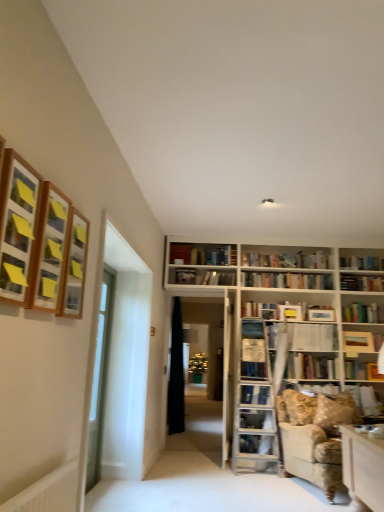
This screenshot has height=512, width=384. Find the location of `black fabric curtain at center`. black fabric curtain at center is located at coordinates (176, 374).

Describe the element at coordinates (313, 337) in the screenshot. This screenshot has height=512, width=384. I see `hardcover book at upper center, the 4th book ordered from the bottom` at that location.

Where is `wooden frame at upper left, arranged as the 3th shelf when viewed from the front`? The width and height of the screenshot is (384, 512). wooden frame at upper left, arranged as the 3th shelf when viewed from the front is located at coordinates (74, 267).

This screenshot has height=512, width=384. I want to click on clear glass door at center, which is the 1th glass door from left to right, so click(99, 380).

At what (x,y) coordinates should I click in order to perform the action: click on wooden bookshelf at upper center, marked as the 3th book in a bottom-to-top arrangement. Please return your answer as a coordinate pair (x, y). Looking at the image, I should click on click(x=358, y=342).

Find the location of a particular element. This screenshot has height=512, width=384. black fabric curtain at center is located at coordinates (176, 374).

From the image's perspective, between hardcover book at lower right, the 3th book positioned from the back, and black fabric curtain at center, who is located below?

black fabric curtain at center appears lower in the image.

Is hardcover book at lower right, which appears as the 1th book when ordered from the bottom, at the right side of black fabric curtain at center?

Yes.

Can you tell me how much hardcover book at lower right, the 3th book positioned from the back, and black fabric curtain at center differ in facing direction?

The angle between the facing direction of hardcover book at lower right, the 3th book positioned from the back, and the facing direction of black fabric curtain at center is 90.3 degrees.

From the image's perspective, between black fabric curtain at center and hardcover book at upper center, arranged as the 3th book when viewed from the front, who is located below?

black fabric curtain at center appears lower in the image.

Which of these two, black fabric curtain at center or hardcover book at upper center, the 4th book ordered from the bottom, stands taller?

black fabric curtain at center is taller.

Looking at this image, based on their sizes in the image, would you say black fabric curtain at center is bigger or smaller than hardcover book at upper center, the 4th book ordered from the bottom?

black fabric curtain at center is bigger than hardcover book at upper center, the 4th book ordered from the bottom.

Visually, is hardcover book at upper center, acting as the 2th book starting from the back, positioned to the left or to the right of wooden bookshelf at center?

In the image, hardcover book at upper center, acting as the 2th book starting from the back, appears on the right side of wooden bookshelf at center.

Is the position of hardcover book at upper center, acting as the 2th book starting from the back, more distant than that of wooden bookshelf at center?

No, it is not.

Is hardcover book at upper center, arranged as the 3th book when viewed from the front, shorter than wooden bookshelf at center?

Yes, hardcover book at upper center, arranged as the 3th book when viewed from the front, is shorter than wooden bookshelf at center.

From a real-world perspective, is hardcover book at upper center, arranged as the 3th book when viewed from the front, above or below wooden bookshelf at center?

From a real-world perspective, hardcover book at upper center, arranged as the 3th book when viewed from the front, is physically above wooden bookshelf at center.

In the scene shown: Can you tell me how much wooden bookshelf at upper center, the 4th book from the front, and hardcover book at lower right, marked as the 4th book in a top-to-bottom arrangement, differ in facing direction?

There is a 2.89-degree angle between the facing directions of wooden bookshelf at upper center, the 4th book from the front, and hardcover book at lower right, marked as the 4th book in a top-to-bottom arrangement.

Does point (370, 349) come in front of point (353, 395)?

No, it is behind (353, 395).

Is wooden bookshelf at upper center, the 4th book from the front, closer to camera compared to hardcover book at lower right, the 2th book from the front?

No, the depth of wooden bookshelf at upper center, the 4th book from the front, is greater than that of hardcover book at lower right, the 2th book from the front.

In the scene shown: Is wooden bookshelf at upper center, the first book positioned from the back, spatially inside hardcover book at lower right, marked as the 4th book in a top-to-bottom arrangement, or outside of it?

wooden bookshelf at upper center, the first book positioned from the back, exists outside the volume of hardcover book at lower right, marked as the 4th book in a top-to-bottom arrangement.

Is wooden bookshelf at upper center, the first book positioned from the back, a part of black fabric curtain at center?

No, wooden bookshelf at upper center, the first book positioned from the back, is not a part of black fabric curtain at center.

Between black fabric curtain at center and wooden bookshelf at upper center, the second book in the top-to-bottom sequence, which one has larger size?

black fabric curtain at center.

Is wooden bookshelf at upper center, the 4th book from the front, at the back of black fabric curtain at center?

black fabric curtain at center is not turned away from wooden bookshelf at upper center, the 4th book from the front.

Would you consider hardcover book at lower right, marked as the 4th book in a top-to-bottom arrangement, to be distant from floral fabric couch at lower right?

No.

From the image's perspective, which one is positioned higher, hardcover book at lower right, which appears as the 1th book when ordered from the bottom, or floral fabric couch at lower right?

hardcover book at lower right, which appears as the 1th book when ordered from the bottom, is shown above in the image.

Is hardcover book at lower right, the 3th book positioned from the back, aimed at floral fabric couch at lower right?

No, hardcover book at lower right, the 3th book positioned from the back, is not turned towards floral fabric couch at lower right.

Considering the sizes of objects hardcover book at lower right, which appears as the 1th book when ordered from the bottom, and floral fabric couch at lower right in the image provided, who is wider, hardcover book at lower right, which appears as the 1th book when ordered from the bottom, or floral fabric couch at lower right?

floral fabric couch at lower right.

From a real-world perspective, is wooden framed picture at upper left, the first shelf viewed from the front, positioned above or below wooden frame at upper left, arranged as the 3th shelf when viewed from the front?

Clearly, from a real-world perspective, wooden framed picture at upper left, the first shelf viewed from the front, is above wooden frame at upper left, arranged as the 3th shelf when viewed from the front.

Where is `the 2nd shelf behind the wooden framed picture at upper left, the first shelf viewed from the front, starting your count from the anchor`? The height and width of the screenshot is (512, 384). the 2nd shelf behind the wooden framed picture at upper left, the first shelf viewed from the front, starting your count from the anchor is located at coordinates (74, 267).

Can you tell me how much wooden framed picture at upper left, acting as the 3th shelf starting from the back, and wooden frame at upper left, the first shelf viewed from the back, differ in facing direction?

The angle between the facing direction of wooden framed picture at upper left, acting as the 3th shelf starting from the back, and the facing direction of wooden frame at upper left, the first shelf viewed from the back, is 0.0687 degrees.

Visually, is wooden framed picture at upper left, acting as the 3th shelf starting from the back, positioned to the left or to the right of wooden frame at upper left, the first shelf viewed from the back?

wooden framed picture at upper left, acting as the 3th shelf starting from the back, is positioned on wooden frame at upper left, the first shelf viewed from the back,'s left side.

Find the location of a particular element. This screenshot has width=384, height=512. curtain on the left of hardcover book at lower right, marked as the 4th book in a top-to-bottom arrangement is located at coordinates (176, 374).

Where is `curtain behind the hardcover book at upper center, arranged as the 3th book when viewed from the front`? Image resolution: width=384 pixels, height=512 pixels. curtain behind the hardcover book at upper center, arranged as the 3th book when viewed from the front is located at coordinates (176, 374).

Based on their spatial positions, is black fabric curtain at center or wooden framed picture at upper left, the first shelf viewed from the front, further from wooden bookshelf at upper center, marked as the 3th book in a bottom-to-top arrangement?

Based on the image, wooden framed picture at upper left, the first shelf viewed from the front, appears to be further to wooden bookshelf at upper center, marked as the 3th book in a bottom-to-top arrangement.

Considering their positions, is clear glass door at left, marked as the first glass door in a right-to-left arrangement, positioned closer to hardcover book at center, which is the 4th book in back-to-front order, than wooden bookshelf at upper center, the first book positioned from the back?

Based on the image, wooden bookshelf at upper center, the first book positioned from the back, appears to be nearer to hardcover book at center, which is the 4th book in back-to-front order.

When comparing their distances from wooden frame at upper left, the first shelf viewed from the back, does floral fabric couch at lower right or wooden framed picture at upper left, acting as the 3th shelf starting from the back, seem further?

The object further to wooden frame at upper left, the first shelf viewed from the back, is floral fabric couch at lower right.

Based on their spatial positions, is hardcover book at upper center, placed as the 1th book when sorted from top to bottom, or hardcover book at center, which is the 4th book in back-to-front order, closer to wooden frame at upper left, the first shelf viewed from the back?

Based on the image, hardcover book at center, which is the 4th book in back-to-front order, appears to be nearer to wooden frame at upper left, the first shelf viewed from the back.

Estimate the real-world distances between objects in this image. Which object is closer to floral fabric couch at lower right, hardcover book at upper center, placed as the 1th book when sorted from top to bottom, or wooden bookshelf at center?

hardcover book at upper center, placed as the 1th book when sorted from top to bottom.

Estimate the real-world distances between objects in this image. Which object is further from wooden framed picture at upper left, acting as the 3th shelf starting from the back, hardcover book at center, positioned as the second book in bottom-to-top order, or wooden bookshelf at upper center, marked as the 3th book in a bottom-to-top arrangement?

wooden bookshelf at upper center, marked as the 3th book in a bottom-to-top arrangement, lies further to wooden framed picture at upper left, acting as the 3th shelf starting from the back, than the other object.

Considering their positions, is wooden bookshelf at center positioned further to clear glass door at left, marked as the first glass door in a right-to-left arrangement, than hardcover book at center, the 3th book in the top-to-bottom sequence?

Based on the image, wooden bookshelf at center appears to be further to clear glass door at left, marked as the first glass door in a right-to-left arrangement.

Considering their positions, is hardcover book at center, which ranks as the 1th book in front-to-back order, positioned closer to wooden frame at upper left, arranged as the 3th shelf when viewed from the front, than wooden frame at upper left, the second shelf in the front-to-back sequence?

Among the two, wooden frame at upper left, the second shelf in the front-to-back sequence, is located nearer to wooden frame at upper left, arranged as the 3th shelf when viewed from the front.

The image size is (384, 512). In order to click on studio couch between clear glass door at left, marked as the first glass door in a right-to-left arrangement, and wooden bookshelf at upper center, marked as the 3th book in a bottom-to-top arrangement, in the front-back direction in this screenshot , I will do `click(308, 443)`.

At what (x,y) coordinates should I click in order to perform the action: click on bookstore between wooden frame at upper left, the second shelf in the front-to-back sequence, and black fabric curtain at center, along the z-axis. Please return your answer as a coordinate pair (x, y). The image size is (384, 512). Looking at the image, I should click on (213, 350).

Where is `studio couch between clear glass door at left, marked as the first glass door in a right-to-left arrangement, and hardcover book at upper center, placed as the 1th book when sorted from top to bottom, in the front-back direction`? This screenshot has width=384, height=512. studio couch between clear glass door at left, marked as the first glass door in a right-to-left arrangement, and hardcover book at upper center, placed as the 1th book when sorted from top to bottom, in the front-back direction is located at coordinates (308, 443).

You are a GUI agent. You are given a task and a screenshot of the screen. Output one action in this format:
    pyautogui.click(x=<x>, y=<y>)
    Task: Click on the bookstore situated between black fabric curtain at center and wooden bookshelf at upper center, the 4th book from the front, from left to right
    
    Given the screenshot: What is the action you would take?
    pyautogui.click(x=213, y=350)